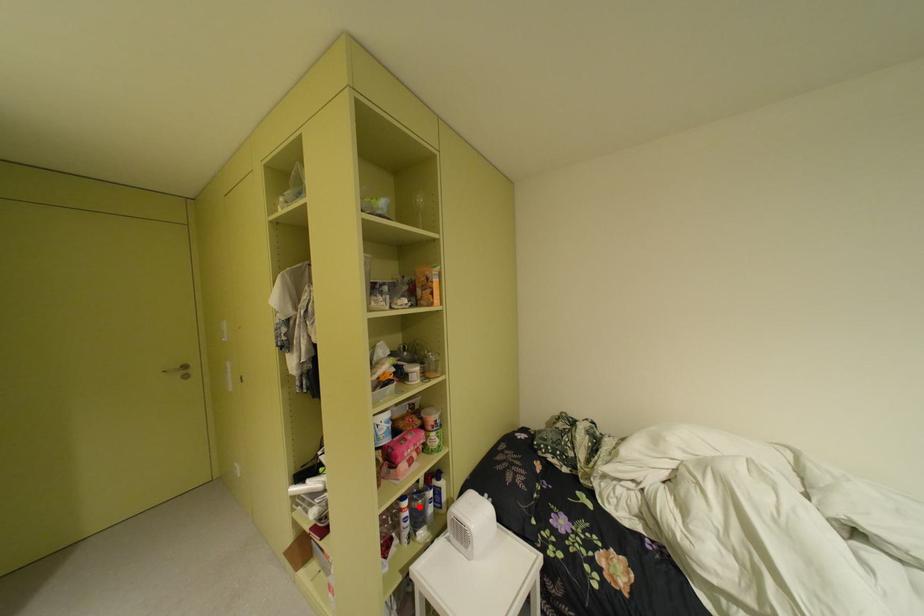
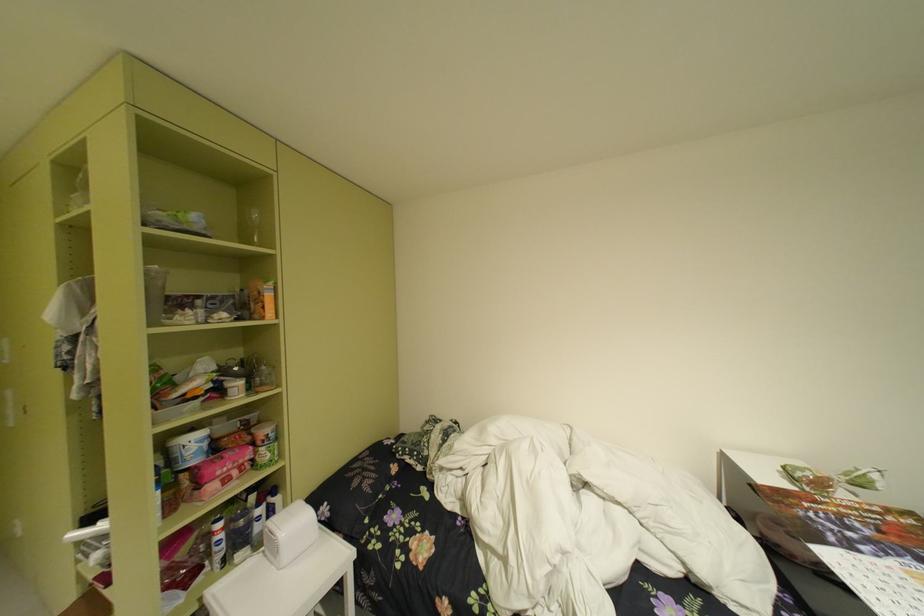
Question: A red point is marked in image1. In image2, is the corresponding 3D point closer to the camera or farther? Reply with the corresponding letter.

Choices:
 (A) The corresponding 3D point is closer.
 (B) The corresponding 3D point is farther.

Answer: (A)